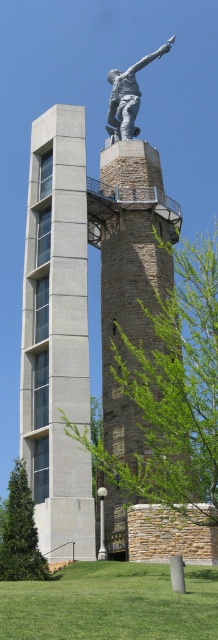
Between point (81, 312) and point (129, 253), which one is positioned behind?

Positioned behind is point (129, 253).

Does concrete tower at center have a greater height compared to stone textured tower at center?

Correct, concrete tower at center is much taller as stone textured tower at center.

Between point (40, 499) and point (165, 230), which one is positioned in front?

Point (40, 499)

This screenshot has width=218, height=640. Find the location of `concrete tower at center`. concrete tower at center is located at coordinates (56, 336).

The width and height of the screenshot is (218, 640). I want to click on concrete tower at center, so click(56, 336).

Is concrete tower at center above polished bronze statue at upper center?

No, concrete tower at center is not above polished bronze statue at upper center.

You are a GUI agent. You are given a task and a screenshot of the screen. Output one action in this format:
    pyautogui.click(x=<x>, y=<y>)
    Task: Click on the concrete tower at center
    The width and height of the screenshot is (218, 640).
    Given the screenshot: What is the action you would take?
    coord(56,336)

Locate an element on the screen. The image size is (218, 640). concrete tower at center is located at coordinates (56, 336).

Is point (122, 202) more distant than point (124, 86)?

No, it is not.

What do you see at coordinates (129, 269) in the screenshot? This screenshot has height=640, width=218. I see `stone textured tower at center` at bounding box center [129, 269].

Find the location of `stone textured tower at center`. stone textured tower at center is located at coordinates (129, 269).